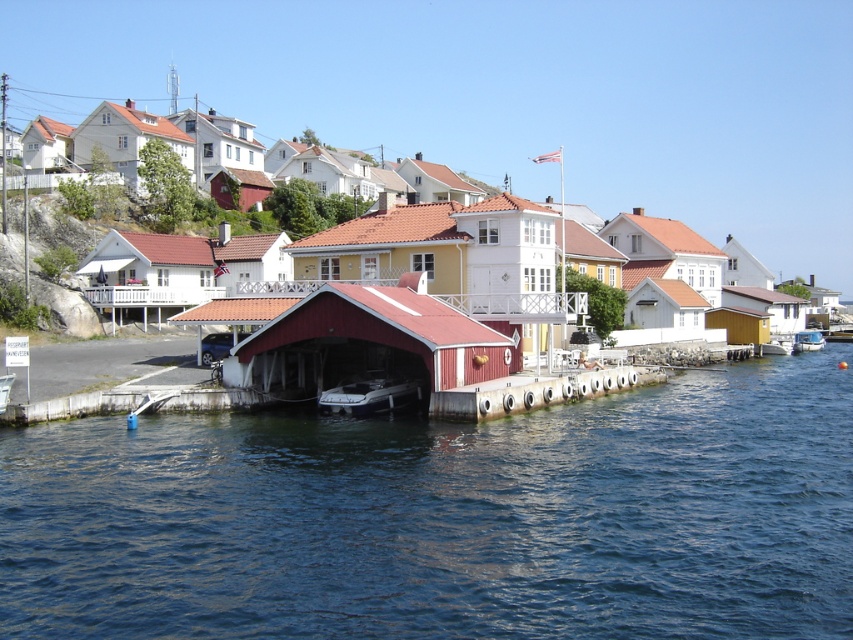
You are standing at the center of the harbor and want to take a photo of both the white wooden house at upper left and the white plastic boat at lower right. Which object will appear larger in your photo?

The white wooden house at upper left will appear larger in the photo because it is closer to the viewer than the white plastic boat at lower right.